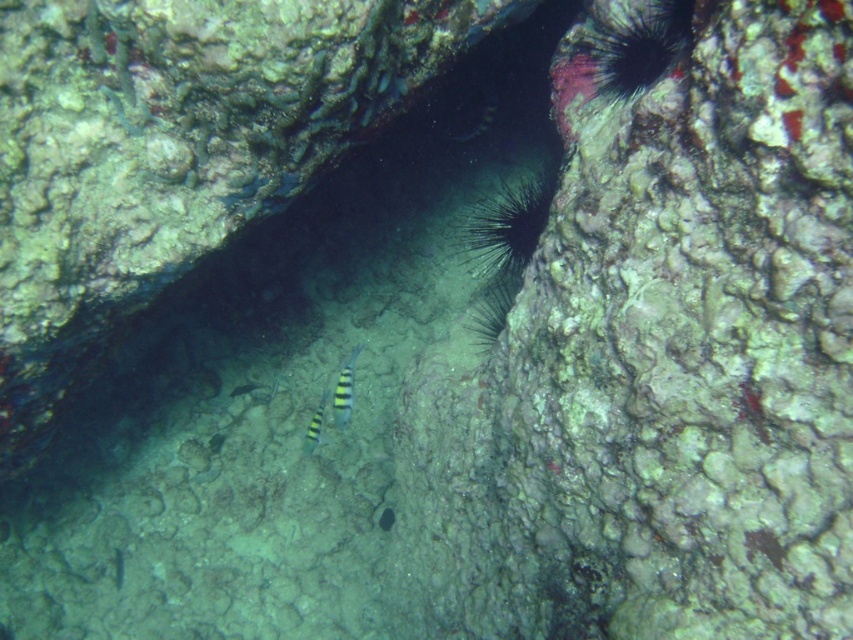
Question: Considering the relative positions of striped yellow and black fish at center and yellow-green striped fish at center in the image provided, where is striped yellow and black fish at center located with respect to yellow-green striped fish at center?

Choices:
 (A) below
 (B) above

Answer: (A)

Question: Is striped yellow and black fish at center wider than yellow-green striped fish at center?

Choices:
 (A) yes
 (B) no

Answer: (A)

Question: Which point is farther to the camera?

Choices:
 (A) yellow striped fish at center
 (B) striped yellow and black fish at center
 (C) yellow-green striped fish at center

Answer: (C)

Question: From the image, what is the correct spatial relationship of multicolored striped fish at center in relation to striped yellow and black fish at center?

Choices:
 (A) above
 (B) below

Answer: (A)

Question: Which of the following is the farthest from the observer?

Choices:
 (A) (310, 445)
 (B) (462, 132)

Answer: (B)

Question: Based on their relative distances, which object is nearer to the yellow striped fish at center?

Choices:
 (A) striped yellow and black fish at center
 (B) yellow-green striped fish at center
 (C) multicolored striped fish at center

Answer: (C)